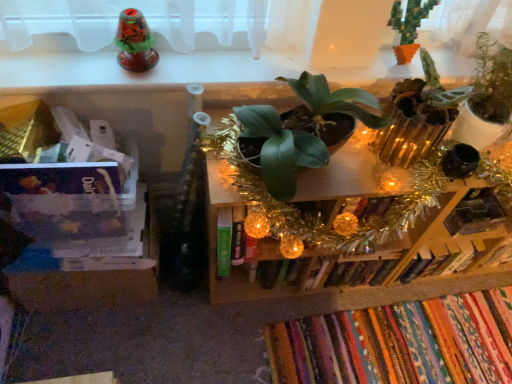
Question: From the image's perspective, relative to green matte plant at upper right, the 3th houseplant viewed from the left, is clear plastic container at left, placed as the 1th shelf when sorted from left to right, above or below?

Choices:
 (A) above
 (B) below

Answer: (B)

Question: In the image, is clear plastic container at left, which appears as the second shelf when viewed from the right, on the left side or the right side of green matte plant at upper right, placed as the 1th houseplant when sorted from right to left?

Choices:
 (A) right
 (B) left

Answer: (B)

Question: Which of these objects is positioned closest to the hardcover book at center-right, which ranks as the 2th book in bottom-to-top order?

Choices:
 (A) green matte plant at upper right, the 3th houseplant viewed from the left
 (B) green matte plant at center, which ranks as the first houseplant in left-to-right order
 (C) green leafy plant at center, the 1th shelf from the right
 (D) green pixelated cactus at upper right, the second houseplant when ordered from left to right
 (E) multicolored woven rug at lower right, placed as the 2th book when sorted from top to bottom

Answer: (C)

Question: Considering the real-world distances, which object is farthest from the green matte plant at upper right, placed as the 1th houseplant when sorted from right to left?

Choices:
 (A) green leafy plant at center, arranged as the second shelf when viewed from the left
 (B) clear plastic container at left, which appears as the second shelf when viewed from the right
 (C) multicolored woven rug at lower right, placed as the 2th book when sorted from top to bottom
 (D) hardcover book at center-right, which ranks as the 2th book in bottom-to-top order
 (E) green pixelated cactus at upper right, the second houseplant when ordered from left to right

Answer: (B)